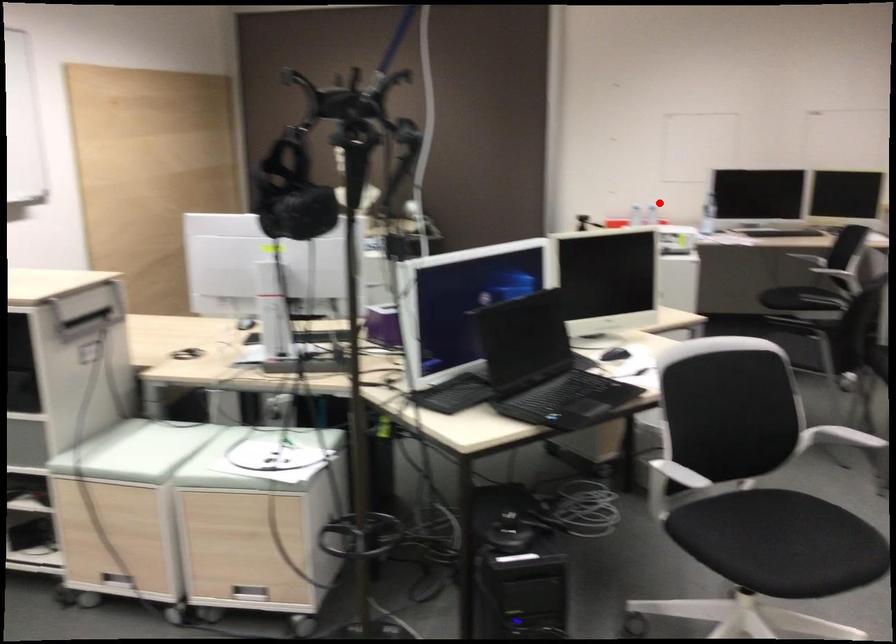
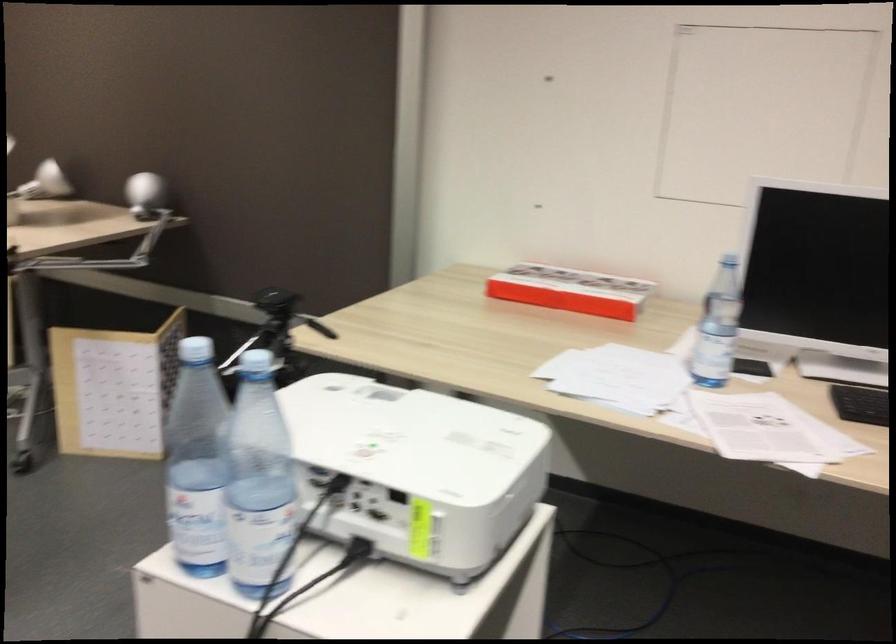
Find the pixel in the second image that matches the highlighted location in the first image.

(570, 290)